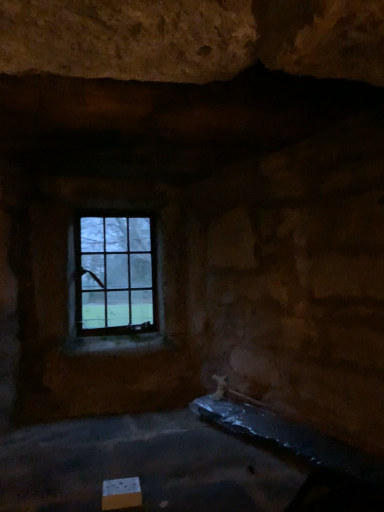
Question: Is point (127, 481) positioned closer to the camera than point (87, 272)?

Choices:
 (A) closer
 (B) farther

Answer: (A)

Question: Is white cardboard box at lower left inside or outside of clear glass window at upper center?

Choices:
 (A) outside
 (B) inside

Answer: (A)

Question: Is white cardboard box at lower left taller or shorter than clear glass window at upper center?

Choices:
 (A) tall
 (B) short

Answer: (B)

Question: Considering the positions of point (119, 230) and point (130, 487), is point (119, 230) closer or farther from the camera than point (130, 487)?

Choices:
 (A) farther
 (B) closer

Answer: (A)

Question: In terms of height, does clear glass window at upper center look taller or shorter compared to white cardboard box at lower left?

Choices:
 (A) tall
 (B) short

Answer: (A)

Question: From the image's perspective, is clear glass window at upper center located above or below white cardboard box at lower left?

Choices:
 (A) below
 (B) above

Answer: (B)

Question: In terms of width, does clear glass window at upper center look wider or thinner when compared to white cardboard box at lower left?

Choices:
 (A) thin
 (B) wide

Answer: (A)